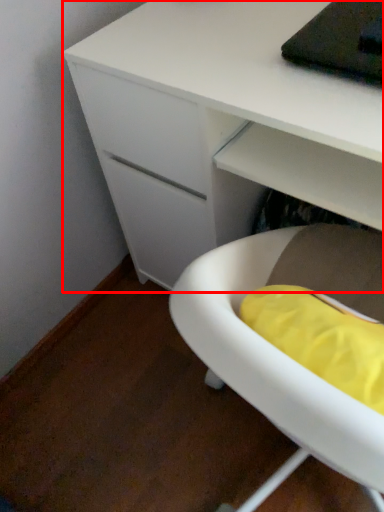
Question: Observing the image, what is the correct spatial positioning of desk (annotated by the red box) in reference to furniture?

Choices:
 (A) right
 (B) left

Answer: (A)